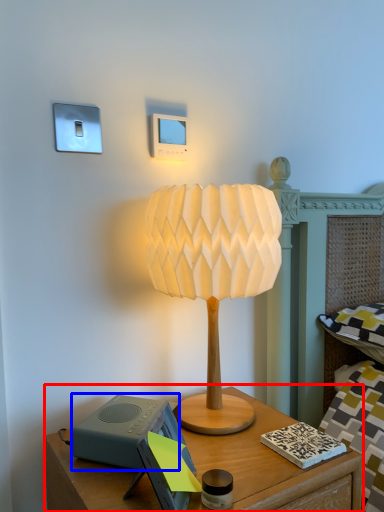
Question: Which object appears farthest to the camera in this image, nightstand (highlighted by a red box) or speaker (highlighted by a blue box)?

Choices:
 (A) nightstand
 (B) speaker

Answer: (B)